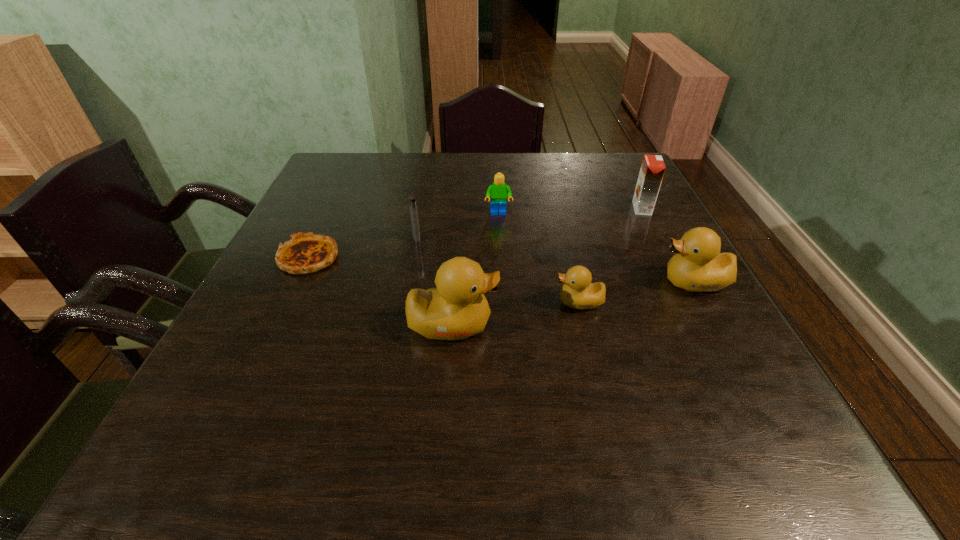
This screenshot has height=540, width=960. I want to click on vacant region that satisfies the following two spatial constraints: 1. on the front side of the orange juice; 2. facing forward on the leftmost duckling, so click(702, 325).

Locate an element on the screen. free spot that satisfies the following two spatial constraints: 1. on the front side of the orange juice; 2. facing forward on the second duckling from left to right is located at coordinates (690, 302).